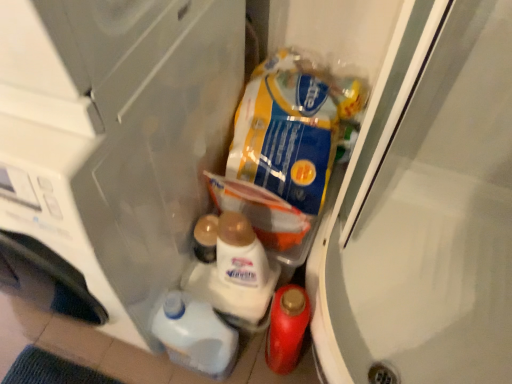
Question: Is the depth of transparent plastic container at lower center less than that of white glossy liquid at lower center, the first snack ordered from the bottom?

Choices:
 (A) no
 (B) yes

Answer: (B)

Question: Is transparent plastic container at lower center looking in the opposite direction of white glossy liquid at lower center, placed as the third snack when sorted from top to bottom?

Choices:
 (A) no
 (B) yes

Answer: (A)

Question: Is transparent plastic container at lower center surrounding white glossy liquid at lower center, placed as the third snack when sorted from top to bottom?

Choices:
 (A) no
 (B) yes

Answer: (A)

Question: From a real-world perspective, does transparent plastic container at lower center stand above white glossy liquid at lower center, placed as the third snack when sorted from top to bottom?

Choices:
 (A) no
 (B) yes

Answer: (B)

Question: From the image's perspective, is transparent plastic container at lower center on top of white glossy liquid at lower center, the first snack ordered from the bottom?

Choices:
 (A) yes
 (B) no

Answer: (A)

Question: In terms of width, does transparent plastic screen door at upper right look wider or thinner when compared to white glossy liquid at lower center, placed as the third snack when sorted from top to bottom?

Choices:
 (A) thin
 (B) wide

Answer: (B)

Question: Considering the relative positions of transparent plastic screen door at upper right and white glossy liquid at lower center, placed as the third snack when sorted from top to bottom, in the image provided, is transparent plastic screen door at upper right to the left or to the right of white glossy liquid at lower center, placed as the third snack when sorted from top to bottom,?

Choices:
 (A) right
 (B) left

Answer: (A)

Question: From a real-world perspective, is transparent plastic screen door at upper right above or below white glossy liquid at lower center, placed as the third snack when sorted from top to bottom?

Choices:
 (A) below
 (B) above

Answer: (A)

Question: In terms of size, does transparent plastic screen door at upper right appear bigger or smaller than white glossy liquid at lower center, the first snack ordered from the bottom?

Choices:
 (A) small
 (B) big

Answer: (B)

Question: From a real-world perspective, is transparent plastic screen door at upper right positioned above or below blue/yellow plastic bag at upper right, the first snack from the top?

Choices:
 (A) below
 (B) above

Answer: (A)

Question: Is transparent plastic screen door at upper right in front of or behind blue/yellow plastic bag at upper right, the first snack from the top, in the image?

Choices:
 (A) front
 (B) behind

Answer: (A)

Question: Would you say transparent plastic screen door at upper right is to the left or to the right of blue/yellow plastic bag at upper right, which is the 3th snack in bottom-to-top order, in the picture?

Choices:
 (A) right
 (B) left

Answer: (A)

Question: Is transparent plastic screen door at upper right bigger or smaller than blue/yellow plastic bag at upper right, the first snack from the top?

Choices:
 (A) big
 (B) small

Answer: (A)

Question: From the image's perspective, is transparent plastic screen door at upper right positioned above or below transparent plastic container at lower center?

Choices:
 (A) above
 (B) below

Answer: (B)

Question: From a real-world perspective, relative to transparent plastic container at lower center, is transparent plastic screen door at upper right vertically above or below?

Choices:
 (A) above
 (B) below

Answer: (B)